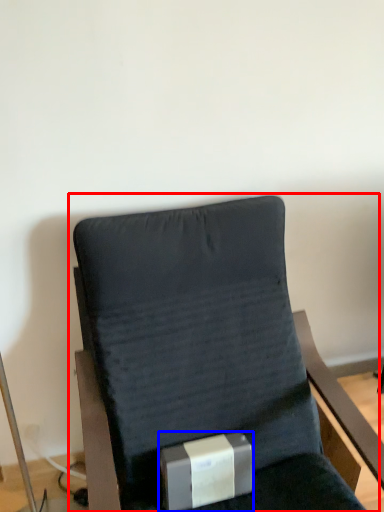
Question: Which object appears closest to the camera in this image, chair (highlighted by a red box) or box (highlighted by a blue box)?

Choices:
 (A) chair
 (B) box

Answer: (A)